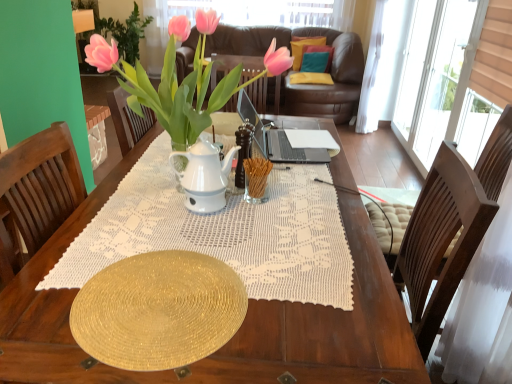
Locate an element on the screen. pink glossy houseplant at upper center is located at coordinates (182, 81).

Where is `yellow fabric pillow at center, positioned as the third pillow in top-to-bottom order`? Image resolution: width=512 pixels, height=384 pixels. yellow fabric pillow at center, positioned as the third pillow in top-to-bottom order is located at coordinates (311, 78).

What do you see at coordinates (158, 311) in the screenshot?
I see `gold textured plate at center` at bounding box center [158, 311].

Locate an element on the screen. The image size is (512, 384). pink glossy houseplant at upper center is located at coordinates (182, 81).

Is yellow fabric pillow at center, marked as the first pillow in a bottom-to-top arrangement, facing away from velvet yellow pillow at upper center, acting as the 3th pillow starting from the bottom?

No, velvet yellow pillow at upper center, acting as the 3th pillow starting from the bottom, is not at the back of yellow fabric pillow at center, marked as the first pillow in a bottom-to-top arrangement.

Which object is wider, yellow fabric pillow at center, positioned as the third pillow in top-to-bottom order, or velvet yellow pillow at upper center, which ranks as the 1th pillow in top-to-bottom order?

velvet yellow pillow at upper center, which ranks as the 1th pillow in top-to-bottom order.

Could you measure the distance between yellow fabric pillow at center, positioned as the third pillow in top-to-bottom order, and velvet yellow pillow at upper center, acting as the 3th pillow starting from the bottom?

A distance of 9.63 inches exists between yellow fabric pillow at center, positioned as the third pillow in top-to-bottom order, and velvet yellow pillow at upper center, acting as the 3th pillow starting from the bottom.

Which pillow is the 2nd one when counting from the right side of the velvet yellow pillow at upper center, which ranks as the 1th pillow in top-to-bottom order? Please provide its 2D coordinates.

[(311, 78)]

Considering the relative sizes of teal fabric pillow at upper center, arranged as the 2th pillow when viewed from the top, and yellow fabric pillow at center, positioned as the third pillow in top-to-bottom order, in the image provided, is teal fabric pillow at upper center, arranged as the 2th pillow when viewed from the top, shorter than yellow fabric pillow at center, positioned as the third pillow in top-to-bottom order,?

No.

Who is more distant, teal fabric pillow at upper center, the 2th pillow from the bottom, or yellow fabric pillow at center, positioned as the third pillow in top-to-bottom order?

teal fabric pillow at upper center, the 2th pillow from the bottom, is further away from the camera.

Based on the photo, considering the relative sizes of teal fabric pillow at upper center, arranged as the 2th pillow when viewed from the top, and yellow fabric pillow at center, marked as the first pillow in a bottom-to-top arrangement, in the image provided, is teal fabric pillow at upper center, arranged as the 2th pillow when viewed from the top, wider than yellow fabric pillow at center, marked as the first pillow in a bottom-to-top arrangement,?

No, teal fabric pillow at upper center, arranged as the 2th pillow when viewed from the top, is not wider than yellow fabric pillow at center, marked as the first pillow in a bottom-to-top arrangement.

Between point (310, 48) and point (293, 82), which one is positioned in front?

The point (293, 82) is closer to the camera.

Would you say yellow fabric pillow at center, positioned as the third pillow in top-to-bottom order, is inside or outside gold textured plate at center?

yellow fabric pillow at center, positioned as the third pillow in top-to-bottom order, is outside gold textured plate at center.

Relative to gold textured plate at center, is yellow fabric pillow at center, marked as the first pillow in a bottom-to-top arrangement, in front or behind?

In the image, yellow fabric pillow at center, marked as the first pillow in a bottom-to-top arrangement, appears behind gold textured plate at center.

In the scene shown: Which of these two, yellow fabric pillow at center, marked as the first pillow in a bottom-to-top arrangement, or gold textured plate at center, is bigger?

yellow fabric pillow at center, marked as the first pillow in a bottom-to-top arrangement.

From the image's perspective, is yellow fabric pillow at center, marked as the first pillow in a bottom-to-top arrangement, on gold textured plate at center?

Yes.

From a real-world perspective, between pink glossy houseplant at upper center and yellow fabric pillow at center, marked as the first pillow in a bottom-to-top arrangement, who is vertically lower?

yellow fabric pillow at center, marked as the first pillow in a bottom-to-top arrangement, from a real-world perspective.

Considering the relative sizes of pink glossy houseplant at upper center and yellow fabric pillow at center, positioned as the third pillow in top-to-bottom order, in the image provided, is pink glossy houseplant at upper center taller than yellow fabric pillow at center, positioned as the third pillow in top-to-bottom order,?

Indeed, pink glossy houseplant at upper center has a greater height compared to yellow fabric pillow at center, positioned as the third pillow in top-to-bottom order.

Is point (200, 58) closer or farther from the camera than point (295, 83)?

Point (200, 58) appears to be closer to the viewer than point (295, 83).

Does pink glossy houseplant at upper center turn towards yellow fabric pillow at center, positioned as the third pillow in top-to-bottom order?

No.

Measure the distance from velvet yellow pillow at upper center, acting as the 3th pillow starting from the bottom, to gold textured plate at center.

A distance of 4.24 meters exists between velvet yellow pillow at upper center, acting as the 3th pillow starting from the bottom, and gold textured plate at center.

Is velvet yellow pillow at upper center, acting as the 3th pillow starting from the bottom, not inside gold textured plate at center?

That's correct, velvet yellow pillow at upper center, acting as the 3th pillow starting from the bottom, is outside of gold textured plate at center.

From the image's perspective, does velvet yellow pillow at upper center, which ranks as the 1th pillow in top-to-bottom order, appear lower than gold textured plate at center?

No, from the image's perspective, velvet yellow pillow at upper center, which ranks as the 1th pillow in top-to-bottom order, is not below gold textured plate at center.

Is velvet yellow pillow at upper center, which ranks as the 1th pillow in top-to-bottom order, bigger or smaller than gold textured plate at center?

Considering their sizes, velvet yellow pillow at upper center, which ranks as the 1th pillow in top-to-bottom order, takes up more space than gold textured plate at center.

In the scene shown: From a real-world perspective, who is located lower, pink glossy houseplant at upper center or velvet yellow pillow at upper center, which ranks as the 1th pillow in top-to-bottom order?

From a 3D spatial view, velvet yellow pillow at upper center, which ranks as the 1th pillow in top-to-bottom order, is below.

Can you confirm if pink glossy houseplant at upper center is shorter than velvet yellow pillow at upper center, acting as the 3th pillow starting from the bottom?

No, pink glossy houseplant at upper center is not shorter than velvet yellow pillow at upper center, acting as the 3th pillow starting from the bottom.

Consider the image. Could you measure the distance between pink glossy houseplant at upper center and velvet yellow pillow at upper center, which ranks as the 1th pillow in top-to-bottom order?

pink glossy houseplant at upper center and velvet yellow pillow at upper center, which ranks as the 1th pillow in top-to-bottom order, are 3.57 meters apart from each other.

Is pink glossy houseplant at upper center wider or thinner than velvet yellow pillow at upper center, acting as the 3th pillow starting from the bottom?

pink glossy houseplant at upper center is wider than velvet yellow pillow at upper center, acting as the 3th pillow starting from the bottom.

Which is more to the right, teal fabric pillow at upper center, the 2th pillow from the bottom, or gold textured plate at center?

Positioned to the right is teal fabric pillow at upper center, the 2th pillow from the bottom.

In the scene shown: Considering the sizes of objects teal fabric pillow at upper center, arranged as the 2th pillow when viewed from the top, and gold textured plate at center in the image provided, who is thinner, teal fabric pillow at upper center, arranged as the 2th pillow when viewed from the top, or gold textured plate at center?

gold textured plate at center.

How different are the orientations of teal fabric pillow at upper center, the 2th pillow from the bottom, and gold textured plate at center in degrees?

The angle between the facing direction of teal fabric pillow at upper center, the 2th pillow from the bottom, and the facing direction of gold textured plate at center is 147 degrees.

Is teal fabric pillow at upper center, the 2th pillow from the bottom, directly adjacent to gold textured plate at center?

Result: teal fabric pillow at upper center, the 2th pillow from the bottom, is not next to gold textured plate at center, and they're not touching.

Where is `pillow that is the 2nd object located above the yellow fabric pillow at center, marked as the first pillow in a bottom-to-top arrangement (from the image's perspective)`? pillow that is the 2nd object located above the yellow fabric pillow at center, marked as the first pillow in a bottom-to-top arrangement (from the image's perspective) is located at coordinates (303, 48).

The image size is (512, 384). Identify the location of pillow below the teal fabric pillow at upper center, the 2th pillow from the bottom (from a real-world perspective). (311, 78).

Considering their positions, is yellow fabric pillow at center, positioned as the third pillow in top-to-bottom order, positioned closer to teal fabric pillow at upper center, the 2th pillow from the bottom, than pink glossy houseplant at upper center?

Among the two, yellow fabric pillow at center, positioned as the third pillow in top-to-bottom order, is located nearer to teal fabric pillow at upper center, the 2th pillow from the bottom.

Estimate the real-world distances between objects in this image. Which object is further from teal fabric pillow at upper center, arranged as the 2th pillow when viewed from the top, velvet yellow pillow at upper center, which ranks as the 1th pillow in top-to-bottom order, or yellow fabric pillow at center, marked as the first pillow in a bottom-to-top arrangement?

yellow fabric pillow at center, marked as the first pillow in a bottom-to-top arrangement, lies further to teal fabric pillow at upper center, arranged as the 2th pillow when viewed from the top, than the other object.

Looking at the image, which one is located closer to velvet yellow pillow at upper center, acting as the 3th pillow starting from the bottom, yellow fabric pillow at center, positioned as the third pillow in top-to-bottom order, or teal fabric pillow at upper center, arranged as the 2th pillow when viewed from the top?

The object closer to velvet yellow pillow at upper center, acting as the 3th pillow starting from the bottom, is teal fabric pillow at upper center, arranged as the 2th pillow when viewed from the top.

Which object lies further to the anchor point teal fabric pillow at upper center, the 2th pillow from the bottom, yellow fabric pillow at center, positioned as the third pillow in top-to-bottom order, or velvet yellow pillow at upper center, which ranks as the 1th pillow in top-to-bottom order?

yellow fabric pillow at center, positioned as the third pillow in top-to-bottom order.

Considering their positions, is yellow fabric pillow at center, marked as the first pillow in a bottom-to-top arrangement, positioned closer to teal fabric pillow at upper center, arranged as the 2th pillow when viewed from the top, than gold textured plate at center?

yellow fabric pillow at center, marked as the first pillow in a bottom-to-top arrangement.

From the image, which object appears to be nearer to teal fabric pillow at upper center, arranged as the 2th pillow when viewed from the top, gold textured plate at center or pink glossy houseplant at upper center?

The object closer to teal fabric pillow at upper center, arranged as the 2th pillow when viewed from the top, is pink glossy houseplant at upper center.

Based on their spatial positions, is teal fabric pillow at upper center, arranged as the 2th pillow when viewed from the top, or velvet yellow pillow at upper center, which ranks as the 1th pillow in top-to-bottom order, further from yellow fabric pillow at center, marked as the first pillow in a bottom-to-top arrangement?

Among the two, velvet yellow pillow at upper center, which ranks as the 1th pillow in top-to-bottom order, is located further to yellow fabric pillow at center, marked as the first pillow in a bottom-to-top arrangement.

Based on the photo, looking at the image, which one is located further to gold textured plate at center, yellow fabric pillow at center, marked as the first pillow in a bottom-to-top arrangement, or pink glossy houseplant at upper center?

yellow fabric pillow at center, marked as the first pillow in a bottom-to-top arrangement, lies further to gold textured plate at center than the other object.

The image size is (512, 384). Identify the location of pillow located between gold textured plate at center and teal fabric pillow at upper center, the 2th pillow from the bottom, in the depth direction. (311, 78).

Image resolution: width=512 pixels, height=384 pixels. In order to click on houseplant between gold textured plate at center and velvet yellow pillow at upper center, which ranks as the 1th pillow in top-to-bottom order, along the z-axis in this screenshot , I will do `click(182, 81)`.

This screenshot has height=384, width=512. What are the coordinates of `pillow located between yellow fabric pillow at center, positioned as the third pillow in top-to-bottom order, and velvet yellow pillow at upper center, which ranks as the 1th pillow in top-to-bottom order, in the depth direction` in the screenshot? It's located at (317, 58).

Locate an element on the screen. The height and width of the screenshot is (384, 512). pillow between pink glossy houseplant at upper center and teal fabric pillow at upper center, the 2th pillow from the bottom, in the front-back direction is located at coordinates (311, 78).